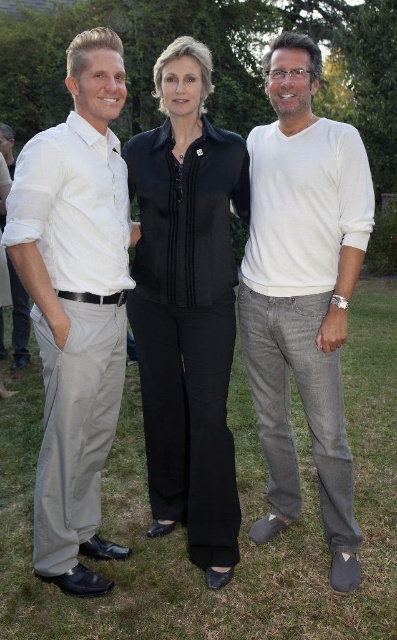
How much distance is there between matte white shirt at left and black satin blouse at center?

The distance of matte white shirt at left from black satin blouse at center is 15.77 inches.

At what (x,y) coordinates should I click in order to perform the action: click on matte white shirt at left. Please return your answer as a coordinate pair (x, y). Looking at the image, I should click on (75, 305).

Between black satin blouse at center and white cotton sweater at center, which one has less height?

white cotton sweater at center

Which is behind, point (161, 164) or point (339, 195)?

The point (161, 164) is behind.

Identify the location of black satin blouse at center. The height and width of the screenshot is (640, 397). (188, 307).

Can you confirm if matte white shirt at left is smaller than white cotton sweater at center?

Indeed, matte white shirt at left has a smaller size compared to white cotton sweater at center.

Is point (46, 342) behind point (277, 317)?

No.

Where is `matte white shirt at left`? Image resolution: width=397 pixels, height=640 pixels. matte white shirt at left is located at coordinates (75, 305).